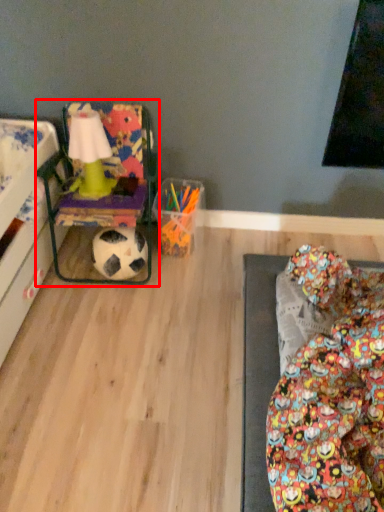
Question: From the image's perspective, where is bean bag chair (annotated by the red box) located in relation to football in the image?

Choices:
 (A) above
 (B) below

Answer: (A)